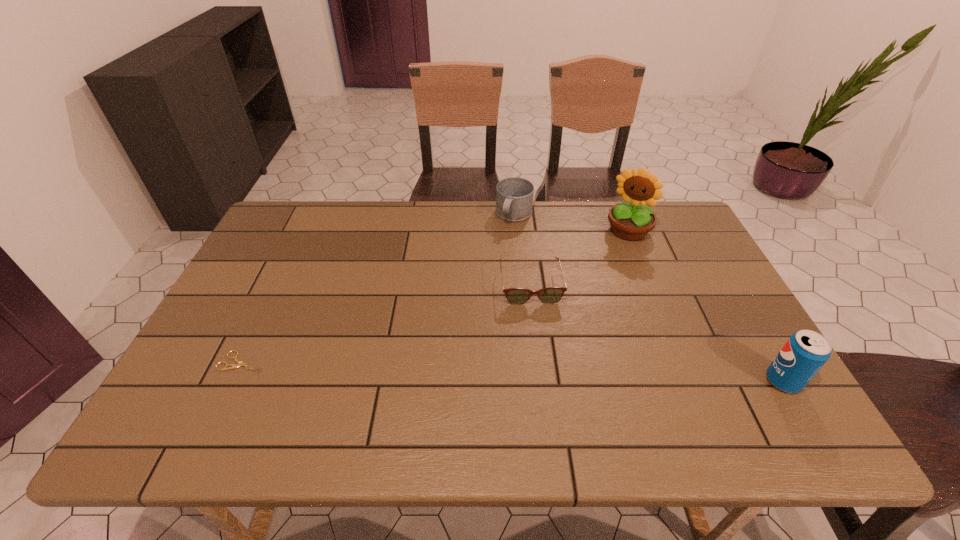
You are a GUI agent. You are given a task and a screenshot of the screen. Output one action in this format:
    pyautogui.click(x=<x>, y=<y>)
    Task: Click on the vacant space located 0.190m on the left of the second tallest object
    
    Given the screenshot: What is the action you would take?
    pyautogui.click(x=684, y=381)

Where is `free space located 0.070m at the front view of the third farthest object`? free space located 0.070m at the front view of the third farthest object is located at coordinates (538, 325).

I want to click on vacant space located at the front view of the third farthest object, so click(537, 319).

Find the location of a particular element. This screenshot has width=960, height=540. free space located 0.130m at the front view of the third farthest object is located at coordinates (540, 343).

The height and width of the screenshot is (540, 960). Identify the location of free space located 0.340m on the face of the sunflower. (582, 312).

Find the location of a particular element. The width and height of the screenshot is (960, 540). vacant space situated on the face of the sunflower is located at coordinates (598, 283).

The image size is (960, 540). What are the coordinates of `vacant space located 0.190m on the face of the sunflower` in the screenshot? It's located at (601, 279).

Identify the location of vacant space located 0.390m on the side of the third tallest object with the handle. This screenshot has width=960, height=540. (468, 313).

Identify the location of free space located 0.280m on the side of the third tallest object with the handle. The height and width of the screenshot is (540, 960). (482, 286).

This screenshot has height=540, width=960. What are the coordinates of `vacant point located 0.240m on the side of the third tallest object with the handle` in the screenshot? It's located at click(x=486, y=277).